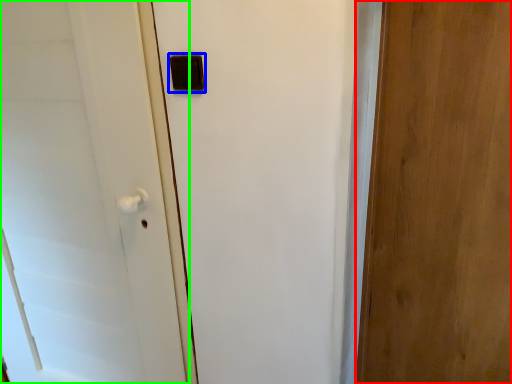
Question: Which is farther away from door (highlighted by a red box)? light switch (highlighted by a blue box) or door (highlighted by a green box)?

Choices:
 (A) light switch
 (B) door

Answer: (B)